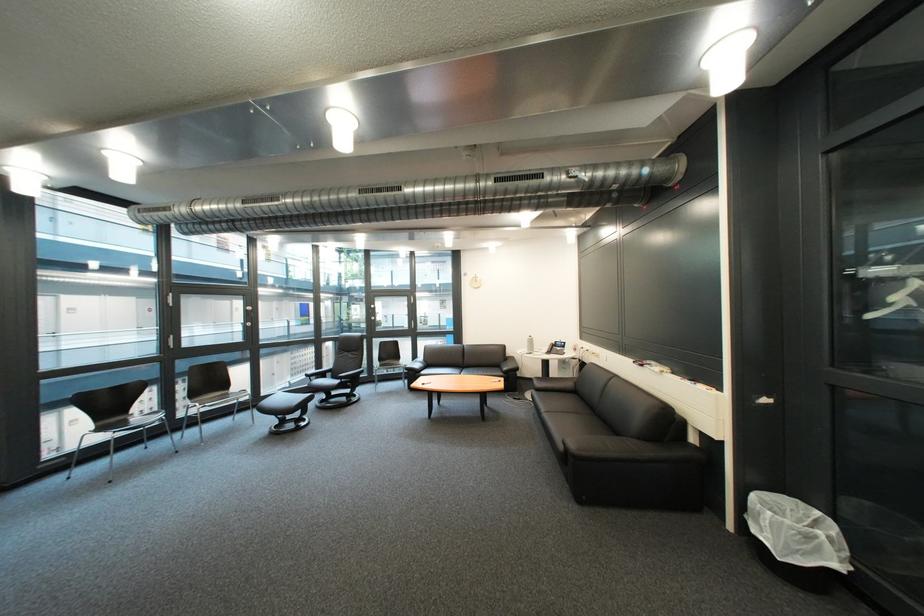
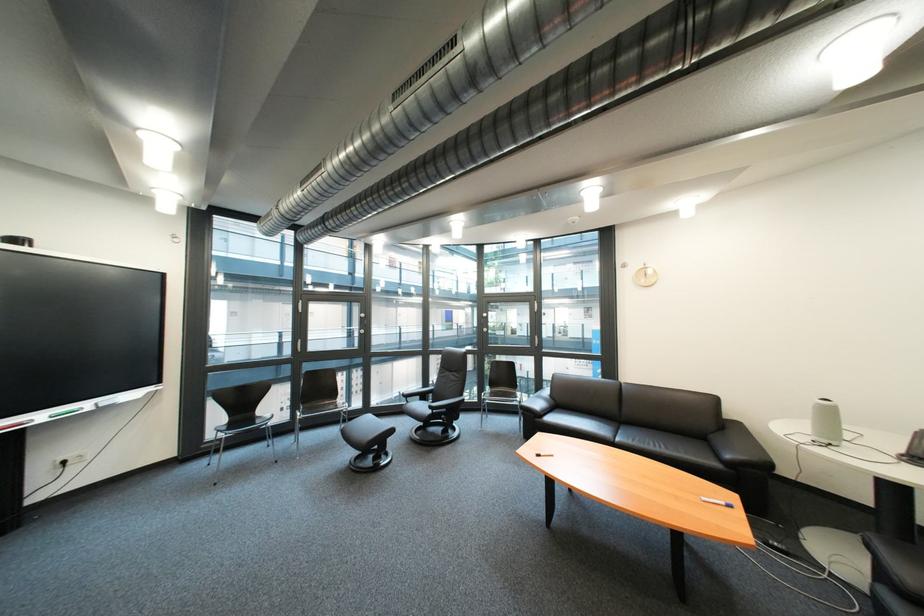
Locate, in the second image, the point that corresponds to the point at 505,383 in the first image.

(718, 501)